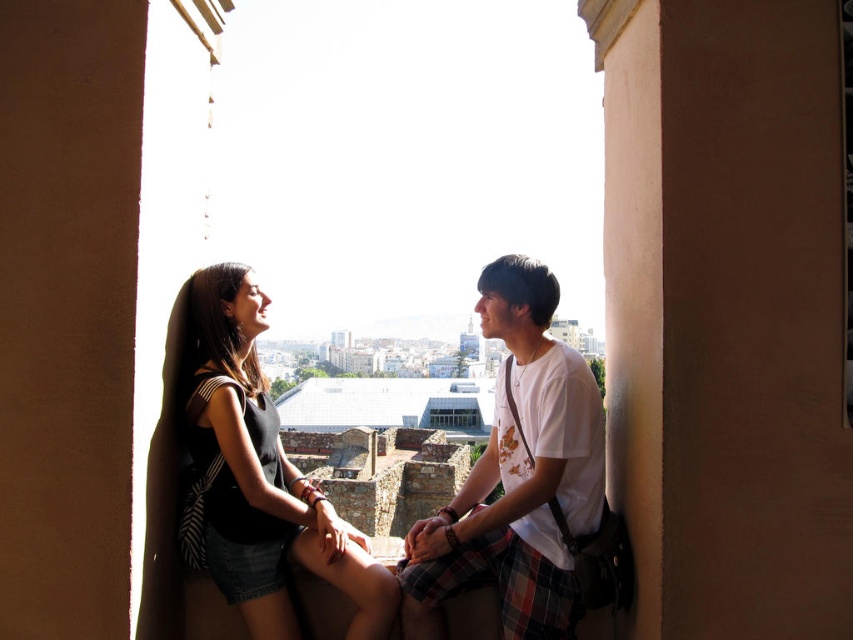
Question: Among these objects, which one is farthest from the camera?

Choices:
 (A) white cotton shirt at center
 (B) smooth beige wall at right
 (C) black matte tank top at center

Answer: (A)

Question: Based on their relative distances, which object is farther from the white cotton shirt at center?

Choices:
 (A) smooth beige wall at right
 (B) black matte tank top at center

Answer: (B)

Question: Which object is closer to the camera taking this photo?

Choices:
 (A) black matte tank top at center
 (B) smooth beige wall at right
 (C) white cotton shirt at center

Answer: (B)

Question: Can you confirm if smooth beige wall at right is smaller than white cotton shirt at center?

Choices:
 (A) no
 (B) yes

Answer: (B)

Question: Does smooth beige wall at right appear over black matte tank top at center?

Choices:
 (A) yes
 (B) no

Answer: (A)

Question: Considering the relative positions of smooth beige wall at right and white cotton shirt at center in the image provided, where is smooth beige wall at right located with respect to white cotton shirt at center?

Choices:
 (A) below
 (B) above

Answer: (B)